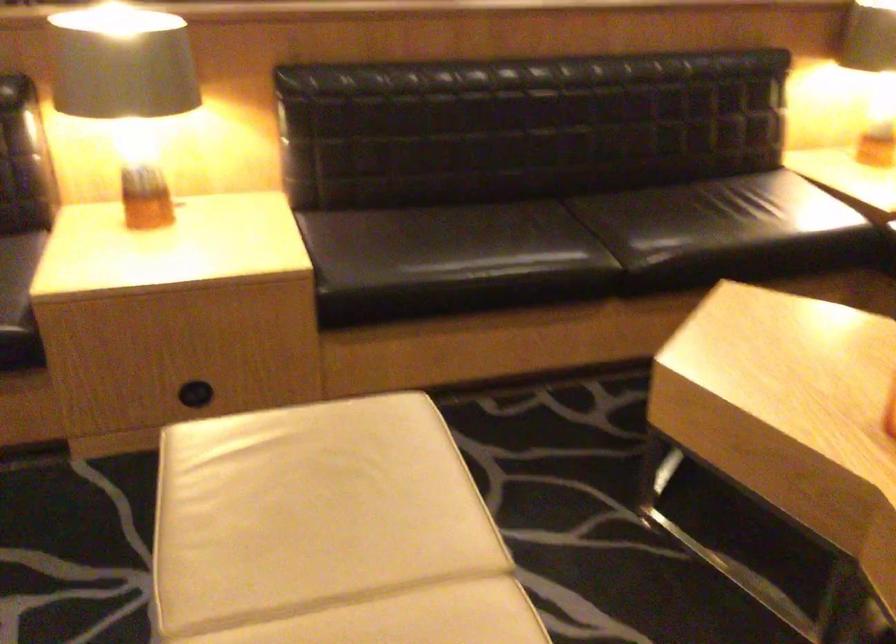
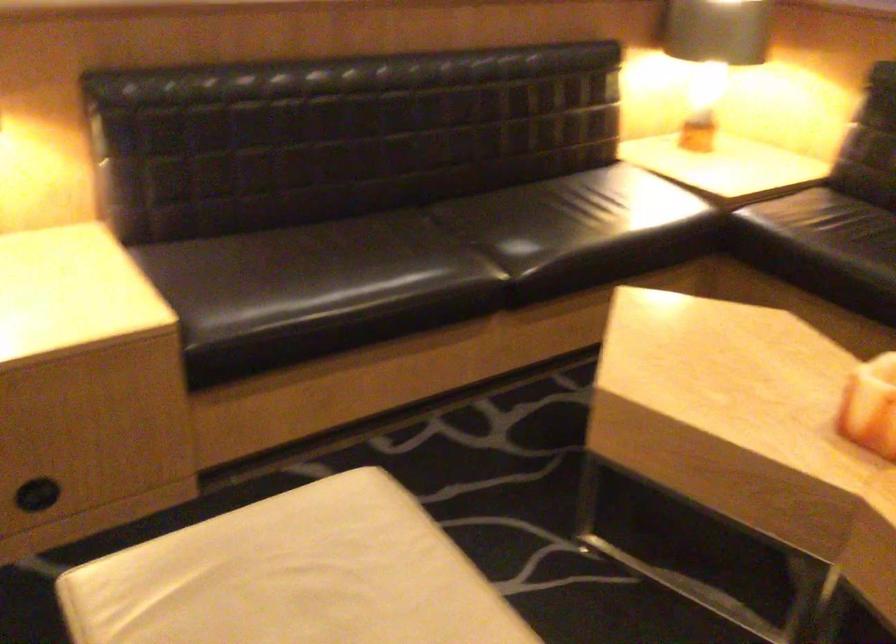
Where in the second image is the point corresponding to (383,489) from the first image?

(391, 610)